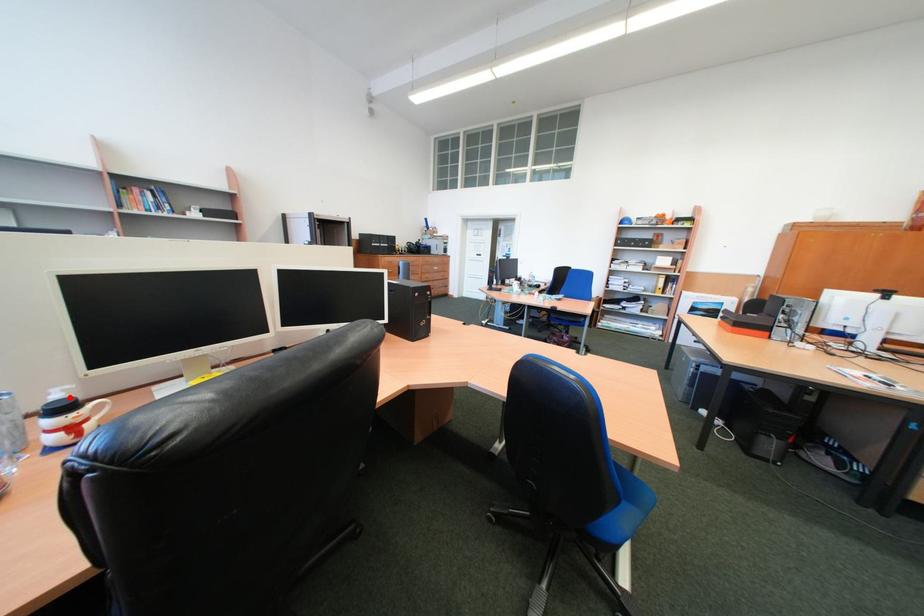
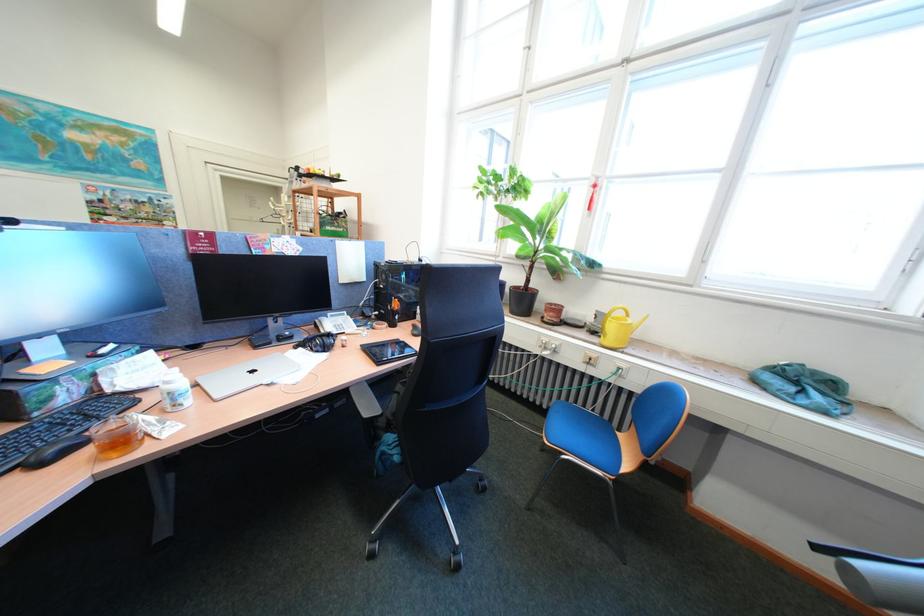
Question: I am providing you with two images of the same scene from different viewpoints. A red point is marked on the first image. Is the red point's position out of view in image 2?

Choices:
 (A) Yes
 (B) No

Answer: (A)